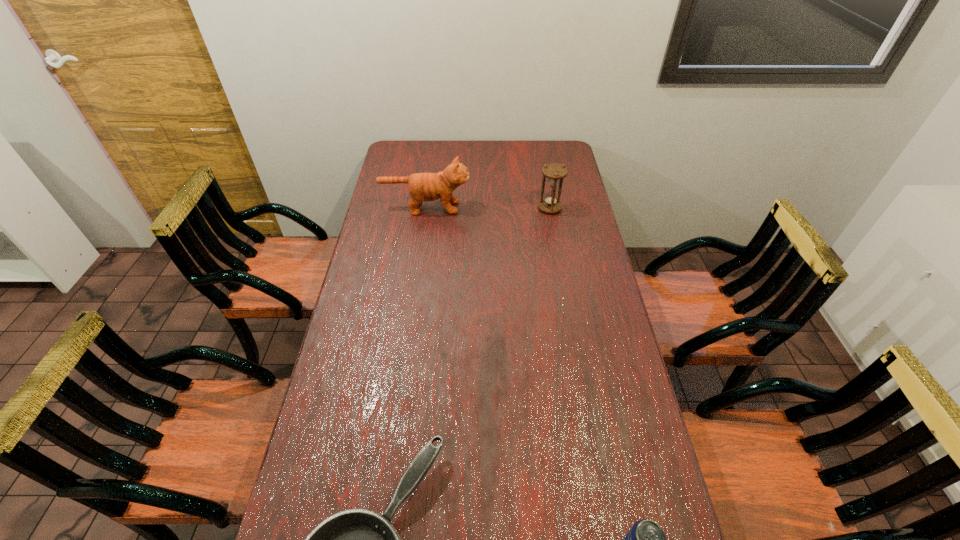
Find the location of a particular element. The image size is (960, 540). cat is located at coordinates (425, 186).

Locate an element on the screen. hourglass is located at coordinates (555, 172).

Find the location of a particular element. vacant area situated on the face of the cat is located at coordinates (543, 207).

Locate an element on the screen. vacant space positioned 0.200m on the front of the second tallest object is located at coordinates (557, 248).

Locate an element on the screen. This screenshot has height=540, width=960. object at the left edge is located at coordinates (425, 186).

In order to click on object present at the right edge in this screenshot , I will do `click(555, 172)`.

Find the location of a particular element. This screenshot has width=960, height=540. vacant area at the far edge of the desktop is located at coordinates (495, 162).

The width and height of the screenshot is (960, 540). What are the coordinates of `free space at the left edge of the desktop` in the screenshot? It's located at (389, 195).

What are the coordinates of `vacant space at the right edge of the desktop` in the screenshot? It's located at (588, 435).

Where is `free space at the far left corner of the desktop`? The image size is (960, 540). free space at the far left corner of the desktop is located at coordinates (420, 156).